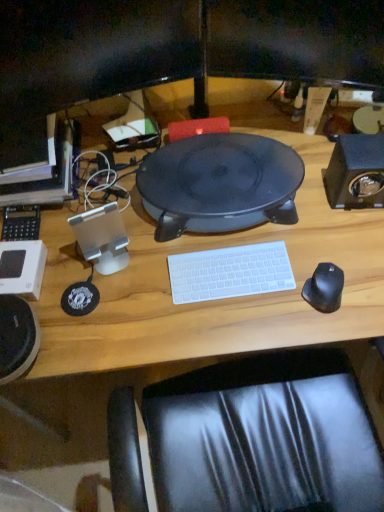
Find the location of a particular element. free point behind white plastic keyboard at center is located at coordinates (226, 234).